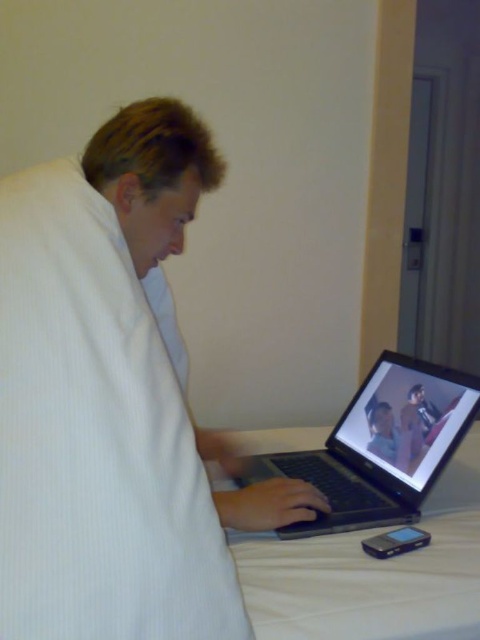
Is point (93, 532) positioned in front of point (314, 595)?

Yes, point (93, 532) is in front of point (314, 595).

Is white textured robe at center smaller than white fabric bed at lower center?

Indeed, white textured robe at center has a smaller size compared to white fabric bed at lower center.

Describe the element at coordinates (97, 435) in the screenshot. This screenshot has height=640, width=480. I see `white textured robe at center` at that location.

The image size is (480, 640). I want to click on white textured robe at center, so click(97, 435).

Between point (262, 620) and point (297, 467), which one is positioned behind?

Positioned behind is point (297, 467).

Who is positioned more to the right, white fabric bed at lower center or black plastic laptop at center?

black plastic laptop at center

Which is in front, point (479, 483) or point (373, 380)?

Point (479, 483)

In order to click on white fabric bed at lower center in this screenshot , I will do tap(373, 572).

Is white textured robe at center behind black plastic laptop at center?

No, it is in front of black plastic laptop at center.

Which of these two, white textured robe at center or black plastic laptop at center, stands shorter?

With less height is black plastic laptop at center.

At what (x,y) coordinates should I click in order to perform the action: click on white textured robe at center. Please return your answer as a coordinate pair (x, y). Image resolution: width=480 pixels, height=640 pixels. Looking at the image, I should click on (97, 435).